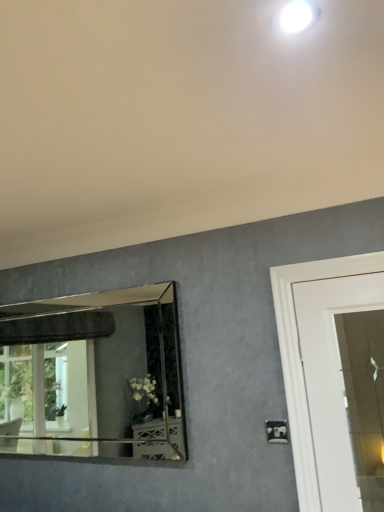
Question: Does white plastic light switch at lower right come behind white glossy droplight at upper center?

Choices:
 (A) no
 (B) yes

Answer: (B)

Question: From the image's perspective, is white plastic light switch at lower right over white glossy droplight at upper center?

Choices:
 (A) yes
 (B) no

Answer: (B)

Question: Is white plastic light switch at lower right to the right of white glossy droplight at upper center from the viewer's perspective?

Choices:
 (A) yes
 (B) no

Answer: (A)

Question: Is white plastic light switch at lower right at the left side of white glossy droplight at upper center?

Choices:
 (A) no
 (B) yes

Answer: (A)

Question: From a real-world perspective, does white plastic light switch at lower right sit lower than white glossy droplight at upper center?

Choices:
 (A) no
 (B) yes

Answer: (B)

Question: Would you say silver-framed mirror at left is inside or outside white plastic light switch at lower right?

Choices:
 (A) inside
 (B) outside

Answer: (B)

Question: Does point (104, 309) appear closer or farther from the camera than point (281, 439)?

Choices:
 (A) closer
 (B) farther

Answer: (B)

Question: From a real-world perspective, is silver-framed mirror at left above or below white plastic light switch at lower right?

Choices:
 (A) above
 (B) below

Answer: (A)

Question: Considering the positions of silver-framed mirror at left and white plastic light switch at lower right in the image, is silver-framed mirror at left bigger or smaller than white plastic light switch at lower right?

Choices:
 (A) big
 (B) small

Answer: (A)

Question: Based on their sizes in the image, would you say white glossy droplight at upper center is bigger or smaller than silver-framed mirror at left?

Choices:
 (A) small
 (B) big

Answer: (A)

Question: Considering the positions of point (276, 27) and point (31, 303), is point (276, 27) closer or farther from the camera than point (31, 303)?

Choices:
 (A) closer
 (B) farther

Answer: (A)

Question: Is white glossy droplight at upper center taller or shorter than silver-framed mirror at left?

Choices:
 (A) tall
 (B) short

Answer: (B)

Question: From a real-world perspective, is white glossy droplight at upper center above or below silver-framed mirror at left?

Choices:
 (A) below
 (B) above

Answer: (B)

Question: Is white glossy droplight at upper center inside the boundaries of white plastic light switch at lower right, or outside?

Choices:
 (A) inside
 (B) outside

Answer: (B)

Question: Visually, is white glossy droplight at upper center positioned to the left or to the right of white plastic light switch at lower right?

Choices:
 (A) right
 (B) left

Answer: (B)